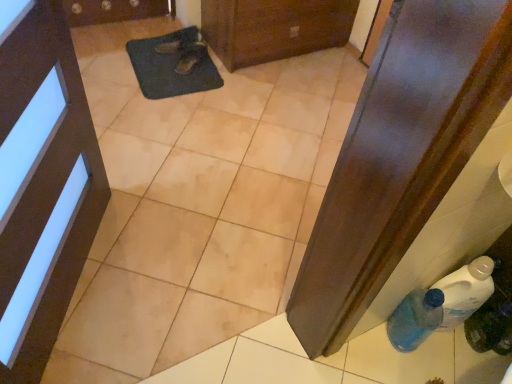
Identify the location of vacant area that is in front of brown wooden door at upper center, which is the 1th door from back to front. The height and width of the screenshot is (384, 512). (269, 98).